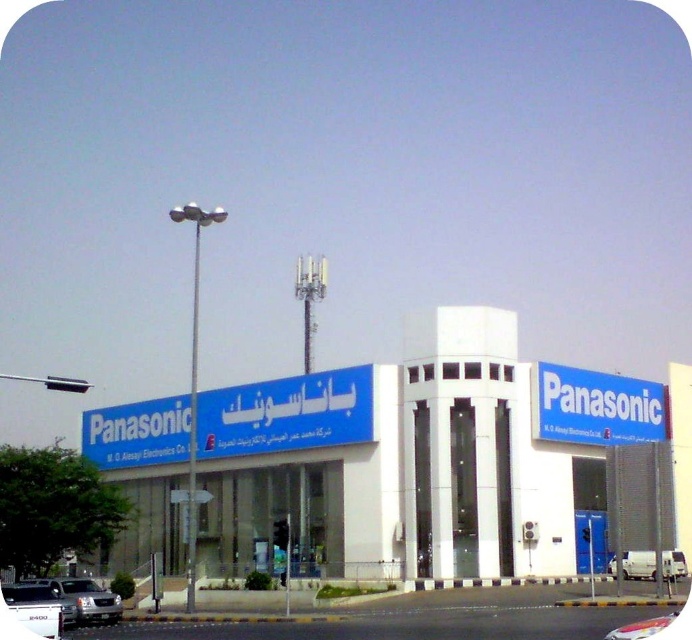
Question: Which is nearer to the white glossy building at center?

Choices:
 (A) white matte van at lower right
 (B) silver metallic sedan at lower left
 (C) white matte van at lower left

Answer: (B)

Question: Is white glossy building at center above white matte van at lower left?

Choices:
 (A) no
 (B) yes

Answer: (B)

Question: Based on their relative distances, which object is nearer to the white glossy building at center?

Choices:
 (A) silver metallic sedan at lower left
 (B) white matte van at lower right
 (C) white matte van at lower left

Answer: (A)

Question: Which object is the farthest from the white glossy building at center?

Choices:
 (A) white matte van at lower right
 (B) silver metallic sedan at lower left

Answer: (A)

Question: Does white glossy building at center have a smaller size compared to white matte van at lower right?

Choices:
 (A) no
 (B) yes

Answer: (A)

Question: Can you confirm if white matte van at lower left is positioned below white matte van at lower right?

Choices:
 (A) yes
 (B) no

Answer: (B)